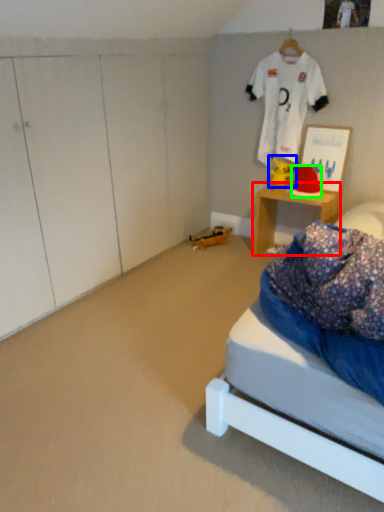
Question: Which object is positioned farthest from desk (highlighted by a red box)? Select from toy (highlighted by a blue box) and hat (highlighted by a green box).

Choices:
 (A) toy
 (B) hat

Answer: (A)